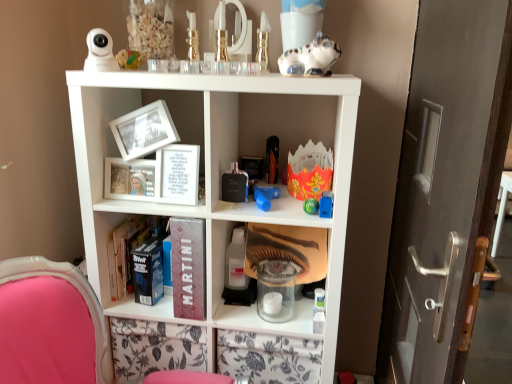
Question: Is point (186, 152) closer or farther from the camera than point (330, 190)?

Choices:
 (A) farther
 (B) closer

Answer: (A)

Question: In terms of height, does white paper frame at center, arranged as the 1th book when viewed from the front, look taller or shorter compared to blue plastic toy at center, which is the ninth toy from left to right?

Choices:
 (A) tall
 (B) short

Answer: (A)

Question: Based on their relative distances, which object is nearer to the white plastic toy at upper left, marked as the ninth toy in a right-to-left arrangement?

Choices:
 (A) matte silver door handle at right
 (B) pink fabric swivel chair at lower left
 (C) gold metallic vase at upper center, which is counted as the 6th toy, starting from the right
 (D) transparent plastic bottle at center
 (E) white glass candle at center, which ranks as the first toy in bottom-to-top order

Answer: (C)

Question: Which of these objects is positioned farthest from the matte silver door handle at right?

Choices:
 (A) matte black rectangular object at center, marked as the fourth toy in a right-to-left arrangement
 (B) dark matte book at center, acting as the second book starting from the front
 (C) shiny blue toy at center, the third toy positioned from the bottom
 (D) gold metallic vase at upper center, marked as the fourth toy in a left-to-right arrangement
 (E) blue rubber toy at center, positioned as the fifth toy in left-to-right order

Answer: (D)